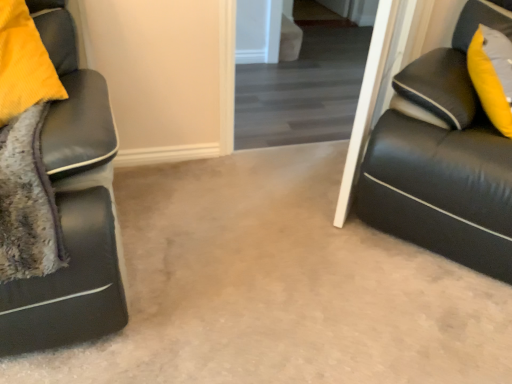
Question: Does matte black couch at right lie in front of transparent glass door at upper center?

Choices:
 (A) no
 (B) yes

Answer: (B)

Question: From the image's perspective, would you say matte black couch at right is shown under transparent glass door at upper center?

Choices:
 (A) yes
 (B) no

Answer: (A)

Question: Is matte black couch at right bigger than transparent glass door at upper center?

Choices:
 (A) no
 (B) yes

Answer: (B)

Question: Is matte black couch at right outside of transparent glass door at upper center?

Choices:
 (A) no
 (B) yes

Answer: (B)

Question: Can you confirm if matte black couch at right is thinner than transparent glass door at upper center?

Choices:
 (A) yes
 (B) no

Answer: (B)

Question: From a real-world perspective, is matte black couch at right below transparent glass door at upper center?

Choices:
 (A) no
 (B) yes

Answer: (A)

Question: From a real-world perspective, is transparent glass door at upper center under matte black couch at right?

Choices:
 (A) no
 (B) yes

Answer: (B)

Question: Is matte black couch at right at the back of transparent glass door at upper center?

Choices:
 (A) yes
 (B) no

Answer: (B)

Question: Can you confirm if transparent glass door at upper center is wider than matte black couch at right?

Choices:
 (A) no
 (B) yes

Answer: (A)

Question: From a real-world perspective, is transparent glass door at upper center positioned over matte black couch at right based on gravity?

Choices:
 (A) yes
 (B) no

Answer: (B)

Question: Is transparent glass door at upper center oriented towards matte black couch at right?

Choices:
 (A) no
 (B) yes

Answer: (B)

Question: Is transparent glass door at upper center bigger than matte black couch at right?

Choices:
 (A) yes
 (B) no

Answer: (B)

Question: Considering the relative positions of matte black couch at right and transparent glass door at upper center in the image provided, is matte black couch at right to the left or to the right of transparent glass door at upper center?

Choices:
 (A) left
 (B) right

Answer: (B)